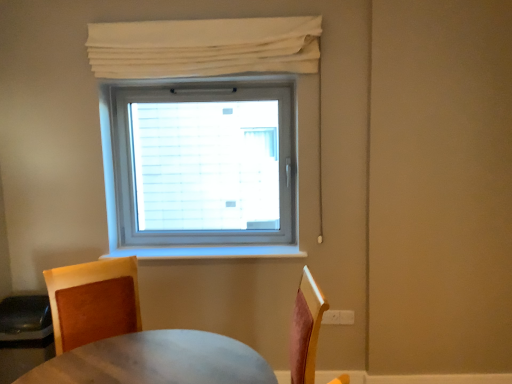
Question: From a real-world perspective, is brown leather chair at lower left located beneath white fabric curtain at upper center?

Choices:
 (A) no
 (B) yes

Answer: (B)

Question: From the image's perspective, does brown leather chair at lower left appear higher than white fabric curtain at upper center?

Choices:
 (A) no
 (B) yes

Answer: (A)

Question: Does brown leather chair at lower left lie in front of white fabric curtain at upper center?

Choices:
 (A) yes
 (B) no

Answer: (A)

Question: Does brown leather chair at lower left have a lesser height compared to white fabric curtain at upper center?

Choices:
 (A) no
 (B) yes

Answer: (A)

Question: Considering the relative positions of brown leather chair at lower left and white fabric curtain at upper center in the image provided, is brown leather chair at lower left to the right of white fabric curtain at upper center from the viewer's perspective?

Choices:
 (A) yes
 (B) no

Answer: (B)

Question: Is brown leather chair at lower left far away from white fabric curtain at upper center?

Choices:
 (A) no
 (B) yes

Answer: (B)

Question: Is white fabric curtain at upper center not near brown leather chair at lower left?

Choices:
 (A) yes
 (B) no

Answer: (A)

Question: Is white fabric curtain at upper center not within brown leather chair at lower left?

Choices:
 (A) no
 (B) yes

Answer: (B)

Question: Is white fabric curtain at upper center placed right next to brown leather chair at lower left?

Choices:
 (A) no
 (B) yes

Answer: (A)

Question: From a real-world perspective, is white fabric curtain at upper center on brown leather chair at lower left?

Choices:
 (A) yes
 (B) no

Answer: (A)

Question: Is the position of white fabric curtain at upper center less distant than that of brown leather chair at lower left?

Choices:
 (A) no
 (B) yes

Answer: (A)

Question: Considering the relative sizes of white fabric curtain at upper center and brown leather chair at lower left in the image provided, is white fabric curtain at upper center thinner than brown leather chair at lower left?

Choices:
 (A) no
 (B) yes

Answer: (B)

Question: Is white fabric curtain at upper center wider or thinner than brown leather chair at lower left?

Choices:
 (A) thin
 (B) wide

Answer: (A)